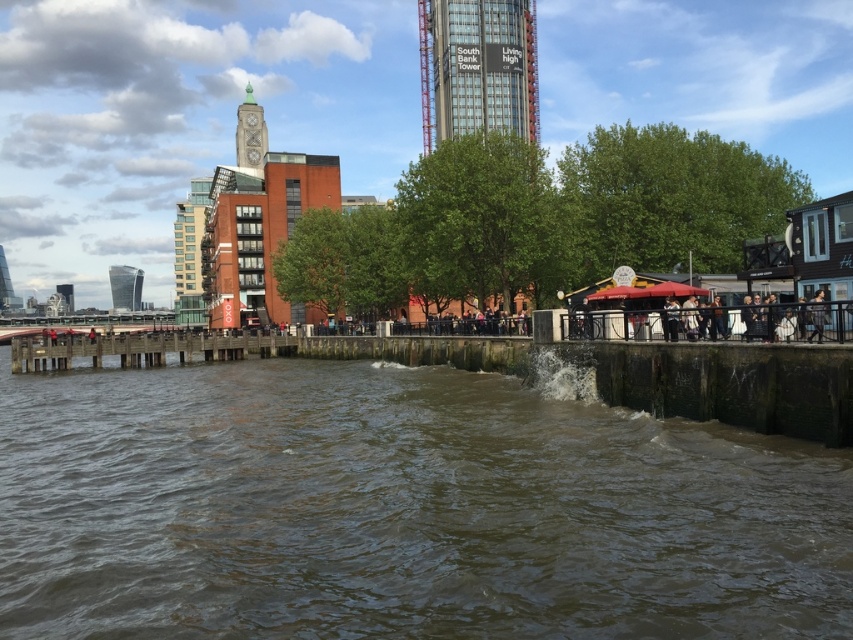
Question: Is silver glass tower at left below matte glass tower at left?

Choices:
 (A) no
 (B) yes

Answer: (A)

Question: Does glassy glass tower at upper center have a greater width compared to silver glass tower at left?

Choices:
 (A) no
 (B) yes

Answer: (A)

Question: Which of the following is the farthest from the observer?

Choices:
 (A) glassy glass tower at upper center
 (B) matte glass tower at left
 (C) brown water at lower center

Answer: (B)

Question: Which of the following is the closest to the observer?

Choices:
 (A) matte gray clock tower at upper center
 (B) silver glass tower at left

Answer: (A)

Question: Which point appears closest to the camera in this image?

Choices:
 (A) (65, 288)
 (B) (258, 164)
 (C) (289, 618)

Answer: (C)

Question: Can you confirm if brown water at lower center is smaller than matte gray clock tower at upper center?

Choices:
 (A) yes
 (B) no

Answer: (A)